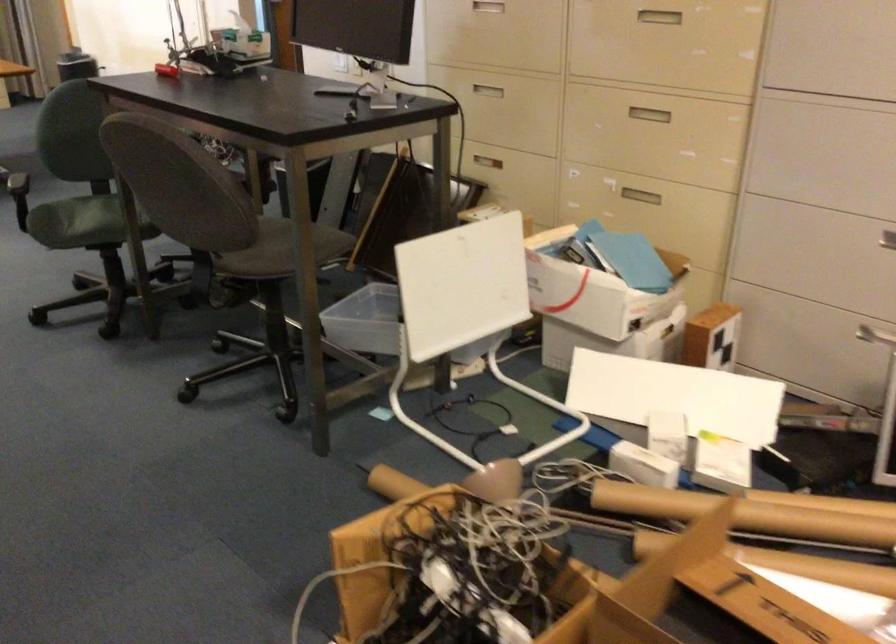
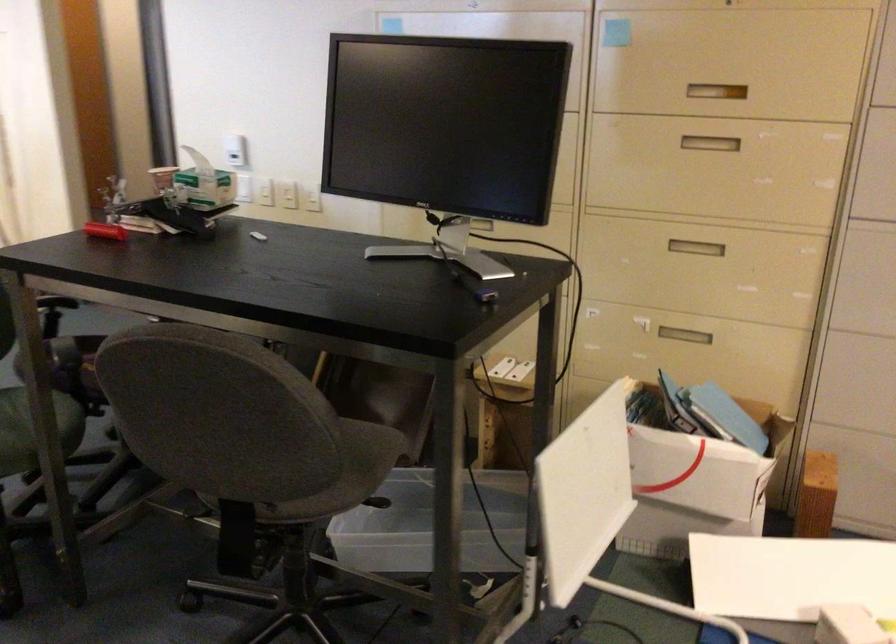
The point at (x=165, y=67) is marked in the first image. Where is the corresponding point in the second image?

(104, 231)